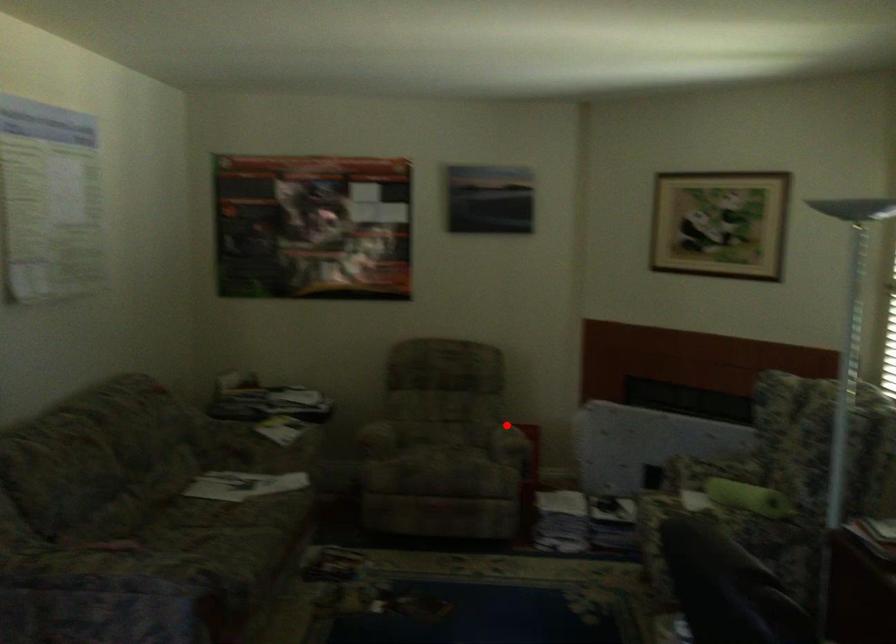
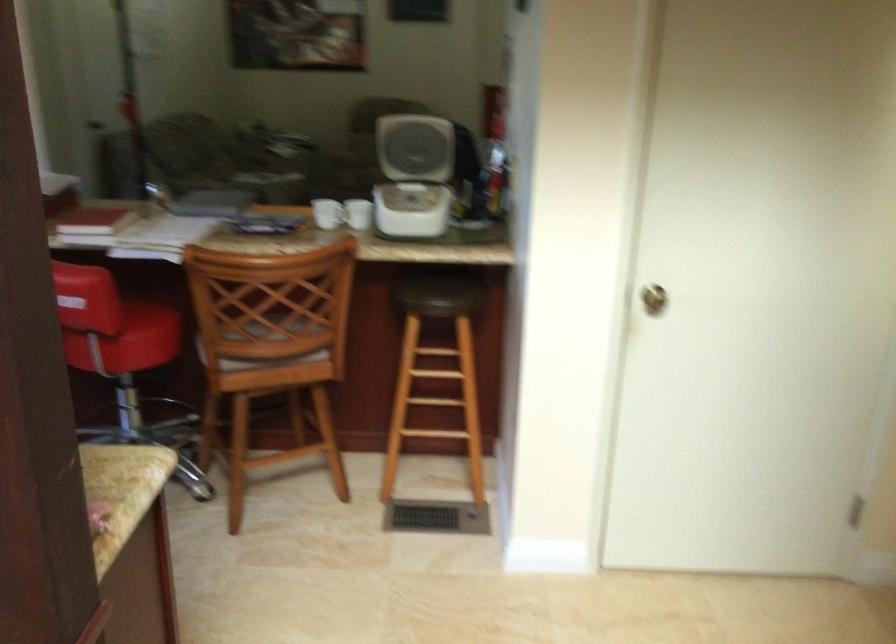
Question: I am providing you with two images of the same scene from different viewpoints. A red point is marked on the first image. Can you still see the location of the red point in image 2?

Choices:
 (A) Yes
 (B) No

Answer: (B)